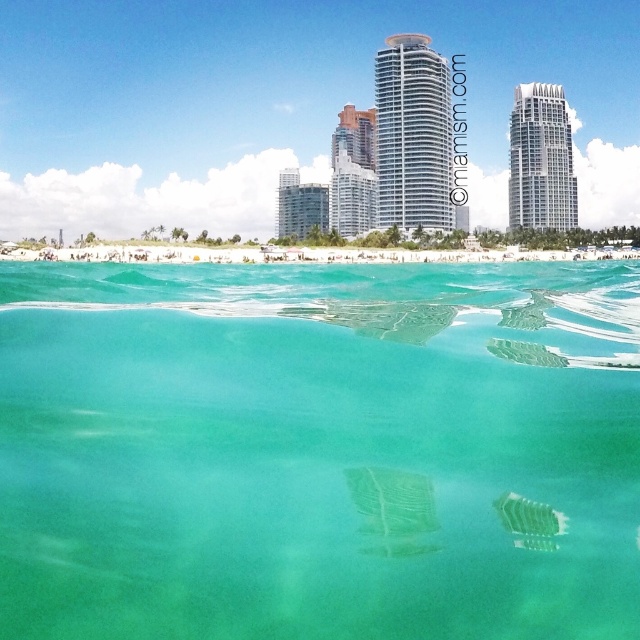
From the picture: Can you confirm if glassy teal skyscraper at center is thinner than green sand at center?

Indeed, glassy teal skyscraper at center has a lesser width compared to green sand at center.

Is glassy teal skyscraper at center bigger than green sand at center?

Incorrect, glassy teal skyscraper at center is not larger than green sand at center.

Find the location of a particular element. glassy teal skyscraper at center is located at coordinates (413, 134).

This screenshot has width=640, height=640. Identify the location of glassy teal skyscraper at center. (413, 134).

What do you see at coordinates (317, 451) in the screenshot?
I see `clear glass water at center` at bounding box center [317, 451].

Which is more to the left, clear glass water at center or white glassy building at upper right?

clear glass water at center

You are a GUI agent. You are given a task and a screenshot of the screen. Output one action in this format:
    pyautogui.click(x=<x>, y=<y>)
    Task: Click on the clear glass water at center
    
    Given the screenshot: What is the action you would take?
    pyautogui.click(x=317, y=451)

Image resolution: width=640 pixels, height=640 pixels. What are the coordinates of `clear glass water at center` in the screenshot? It's located at (317, 451).